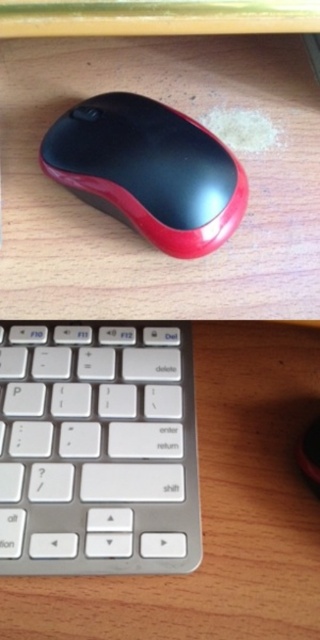
Question: Is white plastic keyboard at center in front of rubberized glossy mouse at center?

Choices:
 (A) no
 (B) yes

Answer: (A)

Question: Which point appears farthest from the camera in this image?

Choices:
 (A) (106, 116)
 (B) (134, 324)

Answer: (B)

Question: Which point is closer to the camera?

Choices:
 (A) white plastic keyboard at center
 (B) rubberized glossy mouse at center

Answer: (B)

Question: Does white plastic keyboard at center appear under rubberized glossy mouse at center?

Choices:
 (A) no
 (B) yes

Answer: (B)

Question: Considering the relative positions of white plastic keyboard at center and rubberized glossy mouse at center in the image provided, where is white plastic keyboard at center located with respect to rubberized glossy mouse at center?

Choices:
 (A) above
 (B) below

Answer: (B)